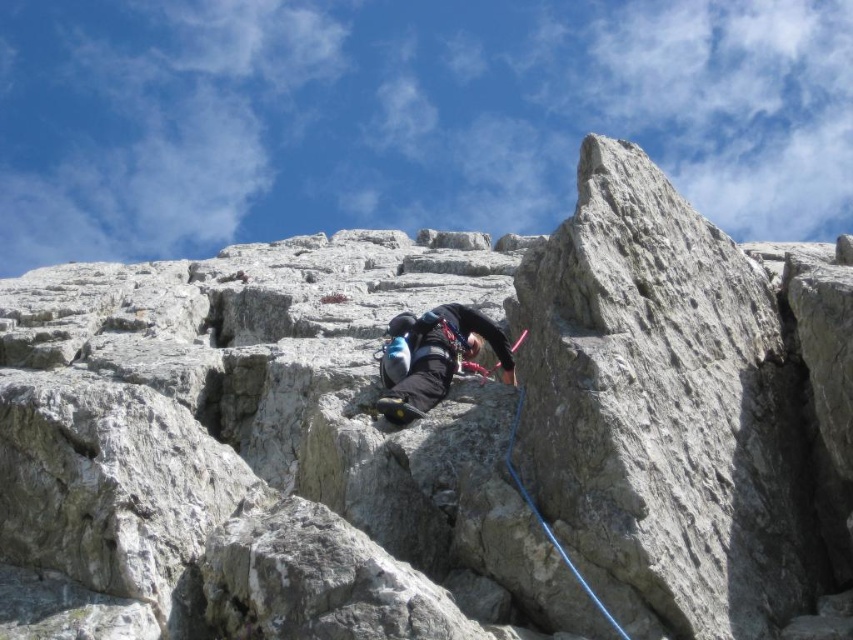
Locate an element on the screen. The image size is (853, 640). black fabric helmet at center is located at coordinates (438, 356).

Between point (410, 316) and point (596, 600), which one is positioned behind?

The point (410, 316) is more distant.

Where is `black fabric helmet at center`? The width and height of the screenshot is (853, 640). black fabric helmet at center is located at coordinates (438, 356).